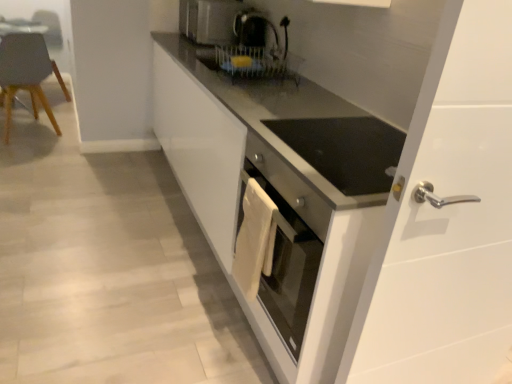
In order to face white glossy door handle at right, should I rotate leftwards or rightwards?

Rotate your view right by about 26.941°.

What do you see at coordinates (26, 74) in the screenshot? This screenshot has width=512, height=384. I see `matte gray chair at left` at bounding box center [26, 74].

The image size is (512, 384). Find the location of `black glossy coffee machine at upper center`. black glossy coffee machine at upper center is located at coordinates (250, 29).

The image size is (512, 384). In order to click on home appliance on the right of matte gray chair at left in this screenshot , I will do `click(209, 20)`.

Is point (53, 125) closer or farther from the camera than point (203, 20)?

Point (53, 125).

Is matte gray chair at left to the right of satin silver toaster at upper center from the viewer's perspective?

No, matte gray chair at left is not to the right of satin silver toaster at upper center.

Could satin silver toaster at upper center be considered to be inside matte gray chair at left?

No, satin silver toaster at upper center is not inside matte gray chair at left.

Does satin silver toaster at upper center appear on the left side of matte gray chair at left?

Incorrect, satin silver toaster at upper center is not on the left side of matte gray chair at left.

From the image's perspective, is satin silver toaster at upper center above matte gray chair at left?

Yes.

Is matte gray chair at left inside satin silver toaster at upper center?

No, matte gray chair at left is not surrounded by satin silver toaster at upper center.

Is satin silver toaster at upper center turned away from matte gray chair at left?

No, satin silver toaster at upper center's orientation is not away from matte gray chair at left.

Is satin silver toaster at upper center directly adjacent to white glossy door handle at right?

satin silver toaster at upper center is not next to white glossy door handle at right, and they're not touching.

Is satin silver toaster at upper center facing towards white glossy door handle at right?

No, satin silver toaster at upper center does not turn towards white glossy door handle at right.

From the image's perspective, does satin silver toaster at upper center appear lower than white glossy door handle at right?

Incorrect, from the image's perspective, satin silver toaster at upper center is higher than white glossy door handle at right.

Does point (228, 10) appear closer or farther from the camera than point (476, 28)?

Point (228, 10) appears to be farther away from the viewer than point (476, 28).

Find the location of a particular element. The height and width of the screenshot is (384, 512). home appliance that appears on the left of white glossy cabinet at center is located at coordinates (209, 20).

Can you confirm if white glossy cabinet at center is thinner than satin silver toaster at upper center?

No.

From a real-world perspective, does white glossy cabinet at center stand above satin silver toaster at upper center?

No.

Does white glossy cabinet at center appear on the right side of satin silver toaster at upper center?

Correct, you'll find white glossy cabinet at center to the right of satin silver toaster at upper center.

Can you see white glossy cabinet at center touching matte gray chair at left?

white glossy cabinet at center and matte gray chair at left are clearly separated.

Who is more distant, white glossy cabinet at center or matte gray chair at left?

matte gray chair at left is behind.

Identify the location of chair that appears above the white glossy cabinet at center (from the image's perspective). This screenshot has height=384, width=512. (26, 74).

Does point (459, 237) come farther from viewer compared to point (26, 69)?

No, it is in front of (26, 69).

Is white glossy door handle at right a part of black glossy coffee machine at upper center?

No, white glossy door handle at right is not inside black glossy coffee machine at upper center.

How much distance is there between black glossy coffee machine at upper center and white glossy door handle at right?

black glossy coffee machine at upper center and white glossy door handle at right are 1.95 meters apart.

Is black glossy coffee machine at upper center closer to the viewer compared to white glossy door handle at right?

That is False.

Considering the sizes of black glossy coffee machine at upper center and white glossy door handle at right in the image, is black glossy coffee machine at upper center taller or shorter than white glossy door handle at right?

In the image, black glossy coffee machine at upper center appears to be shorter than white glossy door handle at right.

Between white glossy door handle at right and black glossy coffee machine at upper center, which one has less height?

Standing shorter between the two is black glossy coffee machine at upper center.

Which point is more distant from viewer, (467, 169) or (257, 12)?

The point (257, 12) is more distant.

From the image's perspective, which is below, white glossy door handle at right or black glossy coffee machine at upper center?

white glossy door handle at right.

Is white glossy door handle at right bigger than black glossy coffee machine at upper center?

Yes, white glossy door handle at right is bigger than black glossy coffee machine at upper center.

Where is `chair below the satin silver toaster at upper center (from the image's perspective)`? Image resolution: width=512 pixels, height=384 pixels. chair below the satin silver toaster at upper center (from the image's perspective) is located at coordinates (26, 74).

Find the location of a particular element. chair below the satin silver toaster at upper center (from a real-world perspective) is located at coordinates (26, 74).

From the image, which object appears to be farther from black glossy coffee machine at upper center, matte gray chair at left or satin silver toaster at upper center?

matte gray chair at left is further to black glossy coffee machine at upper center.

When comparing their distances from white glossy cabinet at center, does white glossy door handle at right or black glossy coffee machine at upper center seem further?

The object further to white glossy cabinet at center is black glossy coffee machine at upper center.

Which object lies further to the anchor point white glossy door handle at right, white glossy cabinet at center or satin silver toaster at upper center?

Among the two, satin silver toaster at upper center is located further to white glossy door handle at right.

Which object lies nearer to the anchor point satin silver toaster at upper center, black glossy coffee machine at upper center or matte gray chair at left?

Based on the image, black glossy coffee machine at upper center appears to be nearer to satin silver toaster at upper center.

Looking at this image, looking at the image, which one is located further to matte gray chair at left, satin silver toaster at upper center or white glossy door handle at right?

The object further to matte gray chair at left is white glossy door handle at right.

From the image, which object appears to be nearer to matte gray chair at left, white glossy door handle at right or satin silver toaster at upper center?

satin silver toaster at upper center.

Looking at the image, which one is located closer to white glossy door handle at right, satin silver toaster at upper center or matte gray chair at left?

The object closer to white glossy door handle at right is satin silver toaster at upper center.

Looking at the image, which one is located closer to matte gray chair at left, white glossy cabinet at center or white glossy door handle at right?

Among the two, white glossy cabinet at center is located nearer to matte gray chair at left.

The height and width of the screenshot is (384, 512). Identify the location of coffee machine positioned between white glossy cabinet at center and satin silver toaster at upper center from near to far. (250, 29).

Find the location of `coffee machine situated between matte gray chair at left and white glossy door handle at right from left to right`. coffee machine situated between matte gray chair at left and white glossy door handle at right from left to right is located at coordinates (250, 29).

Find the location of a particular element. The height and width of the screenshot is (384, 512). home appliance situated between matte gray chair at left and white glossy cabinet at center from left to right is located at coordinates (209, 20).

Where is `cabinetry between matte gray chair at left and black glossy coffee machine at upper center from left to right`? cabinetry between matte gray chair at left and black glossy coffee machine at upper center from left to right is located at coordinates (358, 186).